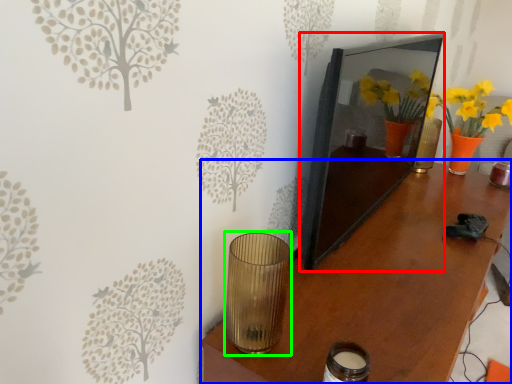
Question: Which is farther away from picture frame (highlighted by a red box)? table (highlighted by a blue box) or candle holder (highlighted by a green box)?

Choices:
 (A) table
 (B) candle holder

Answer: (B)